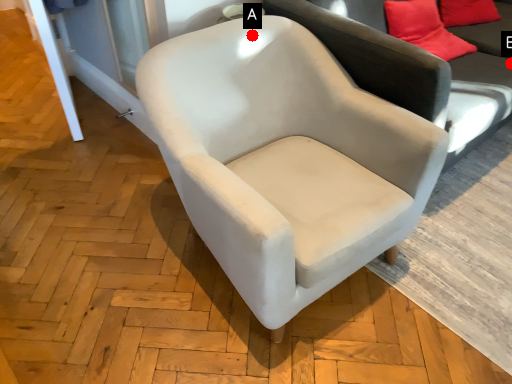
Question: Two points are circled on the image, labeled by A and B beside each circle. Which point is further to the camera?

Choices:
 (A) A is further
 (B) B is further

Answer: (B)